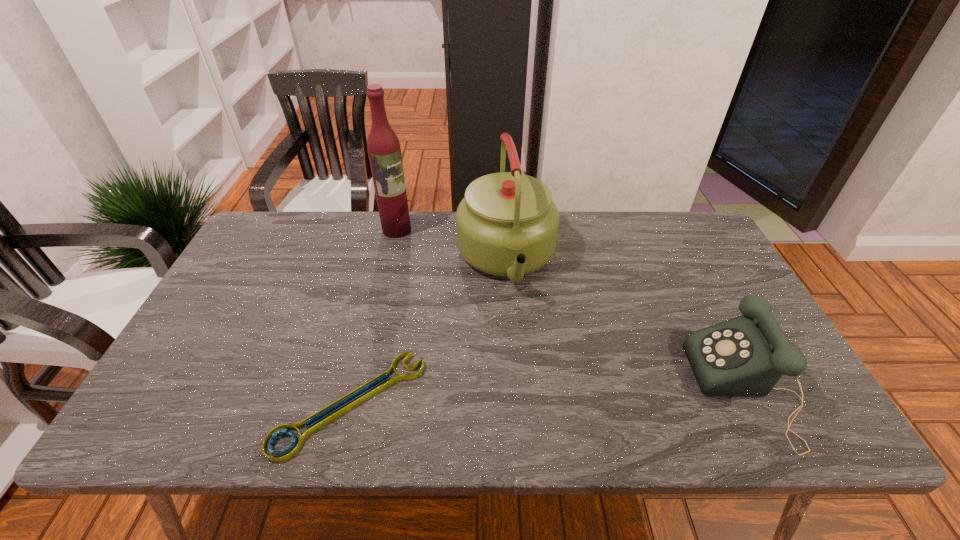
This screenshot has width=960, height=540. Identify the location of vacant area that lies between the tallest object and the third tallest object. click(571, 309).

Locate an element on the screen. The image size is (960, 540). free spot between the liquor and the wrench is located at coordinates click(373, 316).

Where is `free spot between the shortest object and the kettle`? Image resolution: width=960 pixels, height=540 pixels. free spot between the shortest object and the kettle is located at coordinates (428, 332).

You are a GUI agent. You are given a task and a screenshot of the screen. Output one action in this format:
    pyautogui.click(x=<x>, y=<y>)
    Task: Click on the free space between the wrench and the liquor
    Image resolution: width=960 pixels, height=540 pixels.
    Given the screenshot: What is the action you would take?
    pyautogui.click(x=373, y=316)

Image resolution: width=960 pixels, height=540 pixels. Find the location of `blank region between the third object from left to right and the wrench`. blank region between the third object from left to right and the wrench is located at coordinates (428, 332).

Identify the location of free space between the kettle and the rightmost object. The width and height of the screenshot is (960, 540). (626, 324).

Image resolution: width=960 pixels, height=540 pixels. Identify the location of vacant point located between the liquor and the wrench. (373, 316).

The width and height of the screenshot is (960, 540). Find the location of `object that stands as the third closest to the wrench`. object that stands as the third closest to the wrench is located at coordinates [747, 355].

In order to click on object that is the second closest to the kettle in this screenshot , I will do `click(285, 454)`.

Find the location of a particular element. This screenshot has width=960, height=540. free space that satisfies the following two spatial constraints: 1. on the front side of the tallest object; 2. on the dial of the second shortest object is located at coordinates (360, 389).